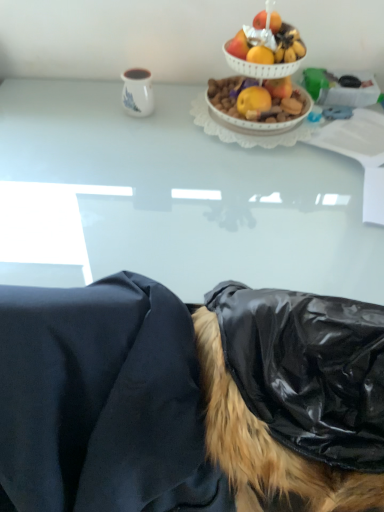
Find the location of a particular element. vacant position to the left of shiny white bowl at upper center is located at coordinates (176, 116).